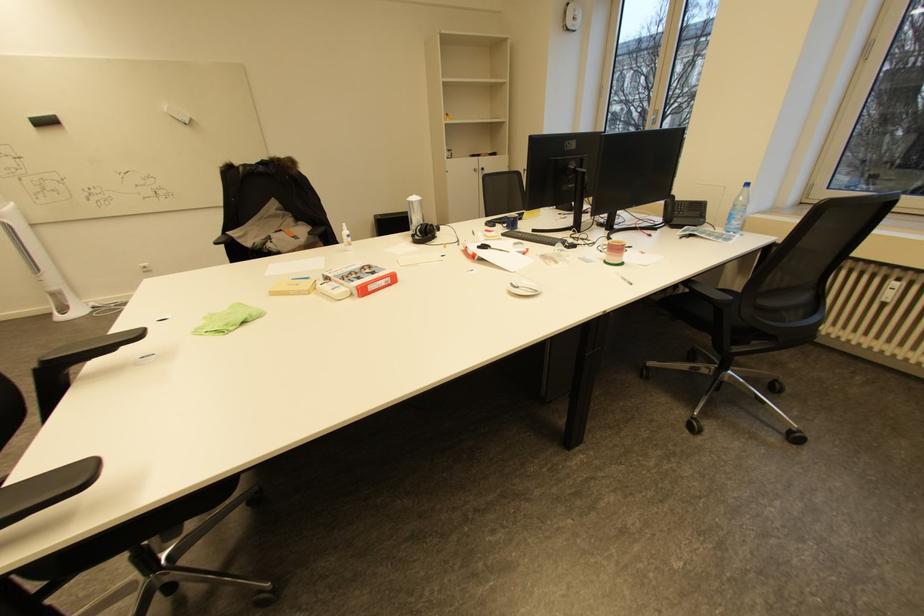
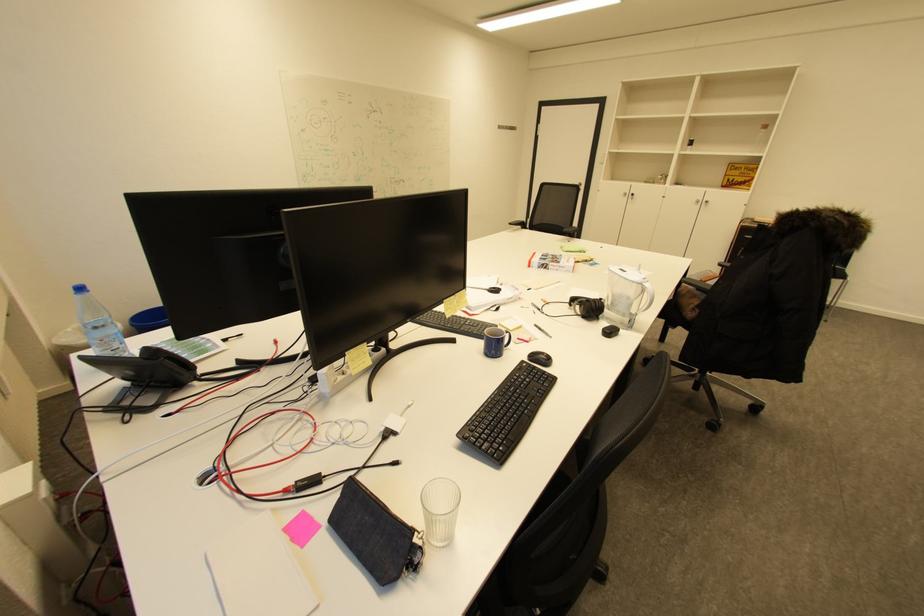
The point at (754, 185) is marked in the first image. Where is the corresponding point in the second image?

(88, 290)